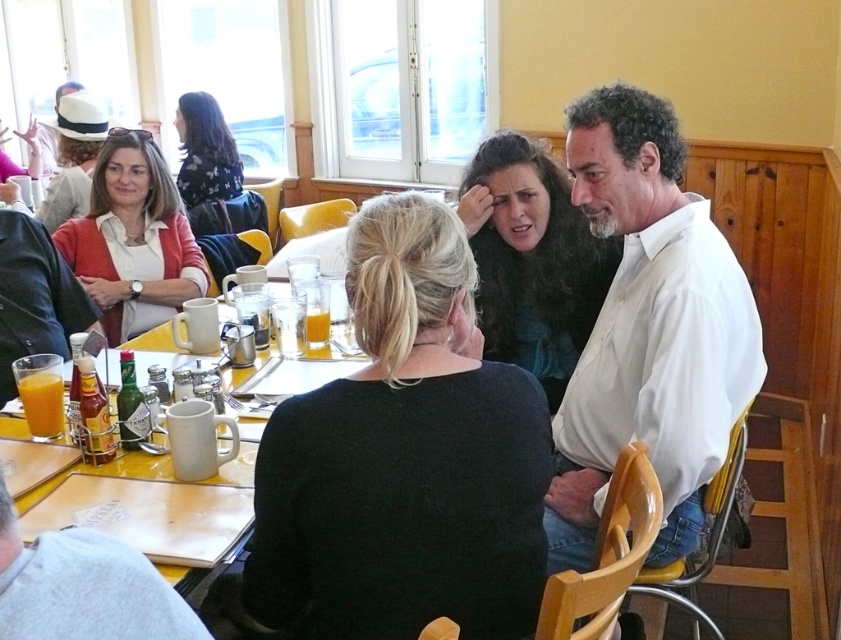
Question: Estimate the real-world distances between objects in this image. Which object is farther from the floral fabric shirt at upper left?

Choices:
 (A) gray cotton shirt at lower left
 (B) green glass bottle at lower left
 (C) translucent glass cup at center

Answer: (A)

Question: Is white ceramic mug at center bigger than translucent glass orange juice at lower left?

Choices:
 (A) no
 (B) yes

Answer: (B)

Question: Considering the relative positions of floral fabric shirt at upper left and translucent glass bottle at center in the image provided, where is floral fabric shirt at upper left located with respect to translucent glass bottle at center?

Choices:
 (A) above
 (B) below

Answer: (A)

Question: Which point is closer to the camera taking this photo?

Choices:
 (A) (128, 440)
 (B) (258, 326)
 (C) (189, 115)

Answer: (A)

Question: Which of the following is the farthest from the observer?

Choices:
 (A) (672, 444)
 (B) (98, 472)
 (C) (434, 605)
 (D) (230, 163)

Answer: (D)

Question: Can you confirm if matte white shirt at upper left is positioned to the left of translucent glass cup at center?

Choices:
 (A) yes
 (B) no

Answer: (A)